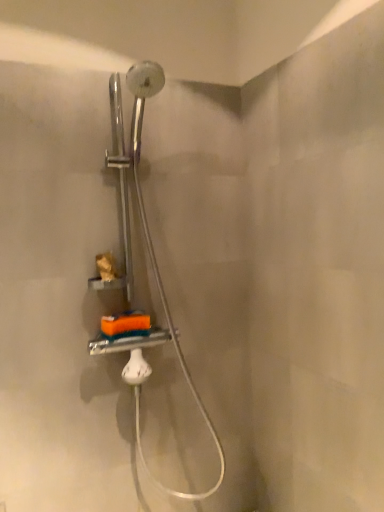
The image size is (384, 512). What do you see at coordinates (148, 227) in the screenshot? I see `metallic silver shower at center` at bounding box center [148, 227].

Locate an element on the screen. metallic silver shower at center is located at coordinates (148, 227).

Find the location of a particular element. Image resolution: width=384 pixels, height=512 pixels. metallic silver shower at center is located at coordinates (148, 227).